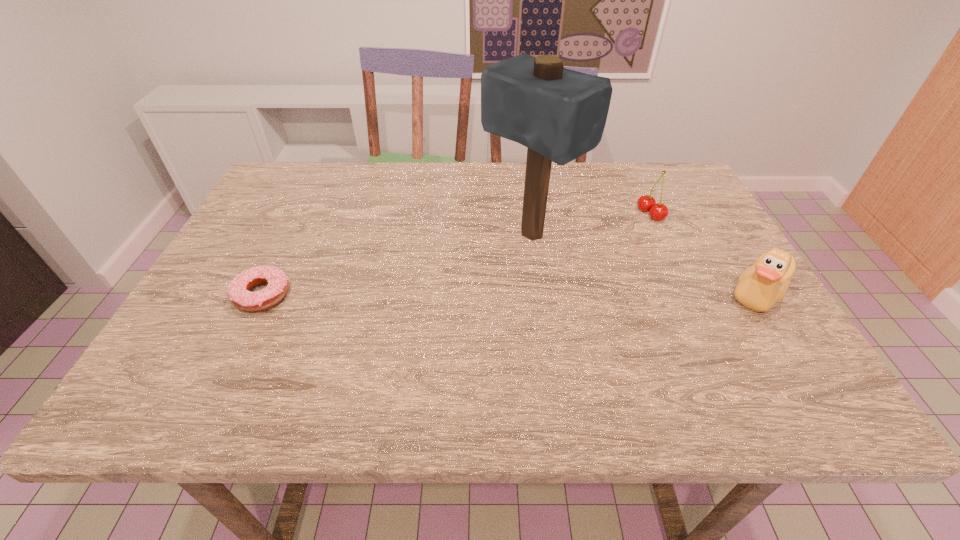
You are a GUI agent. You are given a task and a screenshot of the screen. Output one action in this format:
    pyautogui.click(x=<x>, y=<y>)
    Task: Click on the cherry that is positioned at the right edge
    The width and height of the screenshot is (960, 540).
    Given the screenshot: What is the action you would take?
    pyautogui.click(x=646, y=203)

This screenshot has width=960, height=540. I want to click on object located at the far right corner, so click(646, 203).

The height and width of the screenshot is (540, 960). In the image, there is a desktop. In order to click on blank space at the far edge in this screenshot , I will do `click(343, 199)`.

At what (x,y) coordinates should I click in order to perform the action: click on vacant region at the near edge of the desktop. Please return your answer as a coordinate pair (x, y). The height and width of the screenshot is (540, 960). Looking at the image, I should click on (295, 350).

The height and width of the screenshot is (540, 960). I want to click on vacant space at the left edge of the desktop, so click(273, 239).

This screenshot has width=960, height=540. In order to click on free spot at the right edge of the desktop in this screenshot , I will do `click(670, 213)`.

This screenshot has width=960, height=540. Find the location of `vacant space at the far left corner of the desktop`. vacant space at the far left corner of the desktop is located at coordinates (280, 207).

I want to click on blank space at the far right corner, so click(x=652, y=190).

Find the location of a particular element. This screenshot has width=960, height=540. free point at the near right corner is located at coordinates (759, 358).

The image size is (960, 540). I want to click on unoccupied position between the duck and the leftmost object, so click(510, 294).